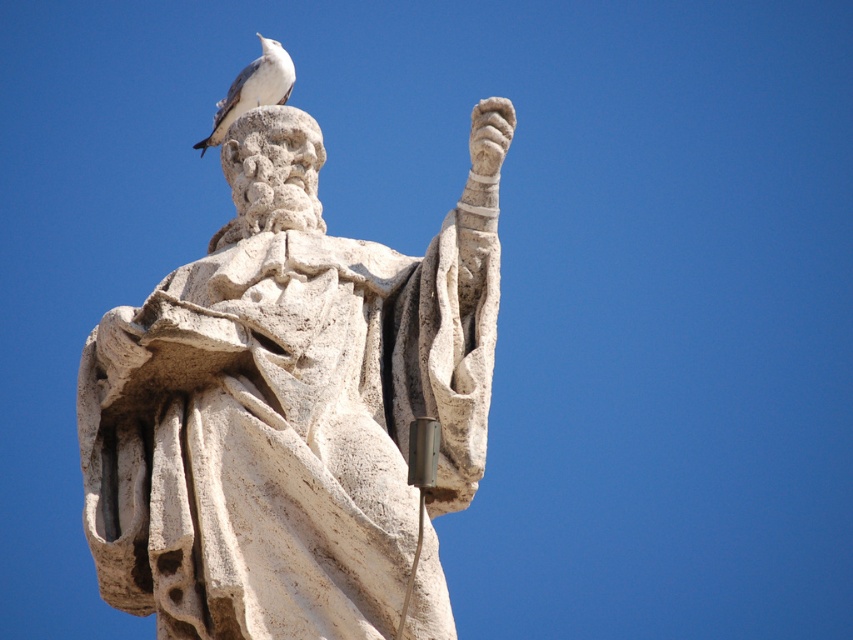
You are an art conservator assessing the stability of the white stone statue at center and the white stone bird at top. Based on their sizes, which object might require more structural support to prevent toppling over?

The white stone statue at center requires more structural support because its width is larger than the white stone bird at top, making it potentially less stable if its base isn not proportionally sturdy.

You are an art conservator assessing the placement of the white stone bird at top on the white stone statue at center. Based on the statue and bird sizes, do you think the bird is proportionally too large for the statue?

The white stone statue at center occupies less space than white stone bird at top, meaning the bird is larger in size. This makes the bird proportionally too large for the statue.